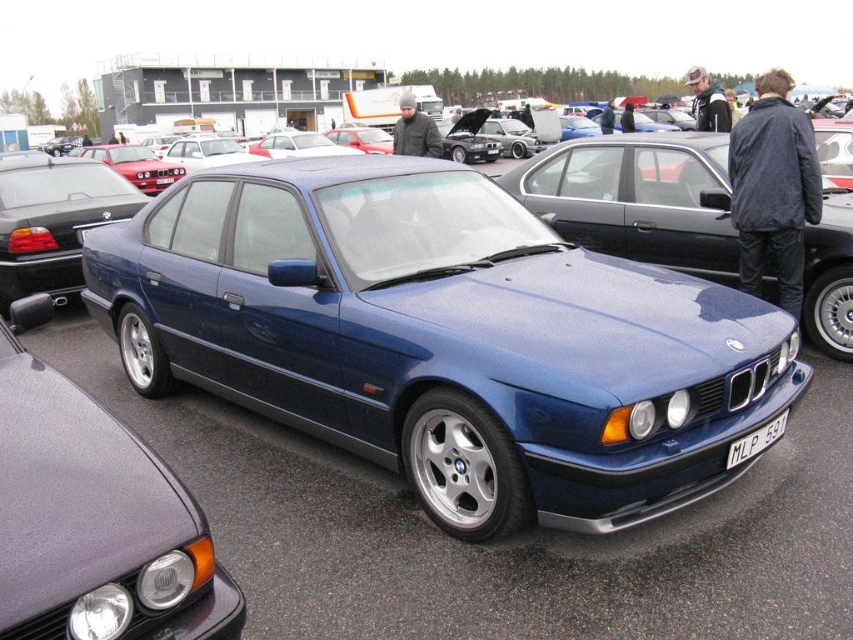
Between metallic blue sedan at center and white plastic license plate at lower center, which one has more height?

Standing taller between the two is metallic blue sedan at center.

Does metallic blue sedan at center have a lesser width compared to white plastic license plate at lower center?

In fact, metallic blue sedan at center might be wider than white plastic license plate at lower center.

Describe the element at coordinates (96, 522) in the screenshot. I see `metallic blue sedan at center` at that location.

The width and height of the screenshot is (853, 640). What are the coordinates of `metallic blue sedan at center` in the screenshot? It's located at (96, 522).

Which is more to the left, metallic blue sedan at center or satin blue sedan at center?

satin blue sedan at center

Is point (57, 620) less distant than point (25, 216)?

Yes, it is in front of point (25, 216).

You are a GUI agent. You are given a task and a screenshot of the screen. Output one action in this format:
    pyautogui.click(x=<x>, y=<y>)
    Task: Click on the metallic blue sedan at center
    
    Given the screenshot: What is the action you would take?
    pyautogui.click(x=96, y=522)

Can you confirm if metallic blue sedan at center is positioned to the left of satin blue car at center?

Correct, you'll find metallic blue sedan at center to the left of satin blue car at center.

Between metallic blue sedan at center and satin blue car at center, which one appears on the right side from the viewer's perspective?

Positioned to the right is satin blue car at center.

Who is more forward, (126, 531) or (566, 148)?

Point (126, 531) is more forward.

Where is `metallic blue sedan at center`? The width and height of the screenshot is (853, 640). metallic blue sedan at center is located at coordinates (96, 522).